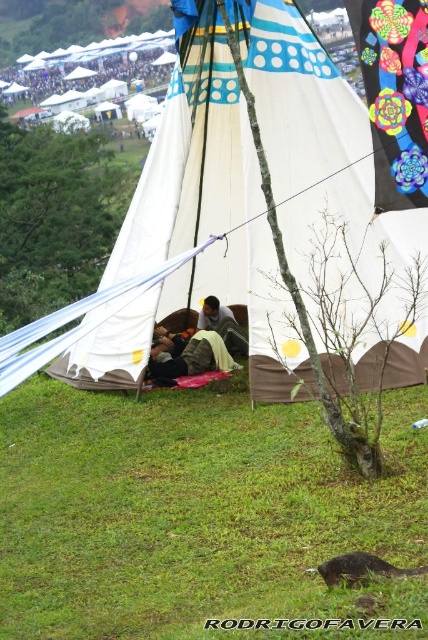
Which is more to the left, white canvas tent at center or camouflage fabric person at center?

camouflage fabric person at center is more to the left.

Does point (297, 140) lie in front of point (228, 330)?

Yes, it is.

Between point (315, 109) and point (205, 316), which one is positioned behind?

Point (205, 316)

Locate an element on the screen. white canvas tent at center is located at coordinates (335, 195).

Which is behind, point (152, 349) or point (225, 316)?

The point (225, 316) is more distant.

Can you confirm if camouflage fabric sleeping bag at center is smaller than camouflage fabric person at center?

Actually, camouflage fabric sleeping bag at center might be larger than camouflage fabric person at center.

Does point (225, 371) come closer to viewer compared to point (219, 323)?

That is True.

At what (x,y) coordinates should I click in order to perform the action: click on camouflage fabric sleeping bag at center. Please return your answer as a coordinate pair (x, y). This screenshot has height=640, width=428. Looking at the image, I should click on (190, 356).

This screenshot has height=640, width=428. Describe the element at coordinates (195, 513) in the screenshot. I see `green grass at lower center` at that location.

Between green grass at lower center and white canvas tent at center, which one has less height?

green grass at lower center

Is point (157, 509) positioned in front of point (237, 284)?

Yes, it is.

Identify the location of green grass at lower center. Image resolution: width=428 pixels, height=640 pixels. (195, 513).